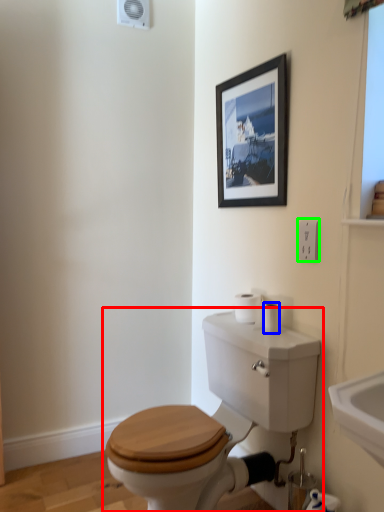
Question: Based on their relative distances, which object is farther from toilet (highlighted by a red box)? Choose from toilet paper (highlighted by a blue box) and electric outlet (highlighted by a green box).

Choices:
 (A) toilet paper
 (B) electric outlet

Answer: (B)